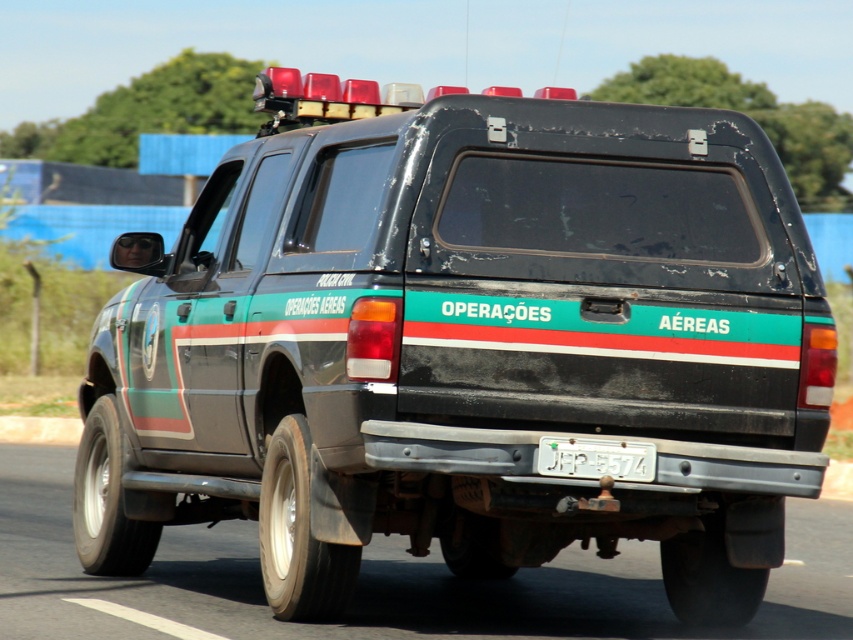
You are a photographer trying to capture the Ford Ranger from the best angle possible. You notice two points on the vehicle, one at point [45,486] and another at point [543,445]. Which point will appear closer to your camera lens?

Point [45,486] is further to the viewer than point [543,445], so the point at [45,486] will appear closer to your camera lens.

You are a driver looking at the gray rubber tire at lower center and the white plastic license plate at center on the Ford Ranger. Which object is closer to the right side of the vehicle?

The gray rubber tire at lower center is to the right of the white plastic license plate at center, so it is closer to the right side of the vehicle.

You are a driver approaching the gray rubber tire at lower center and the white plastic license plate at center. Which object is taller?

The gray rubber tire at lower center is not as tall as the white plastic license plate at center, so the license plate is taller.